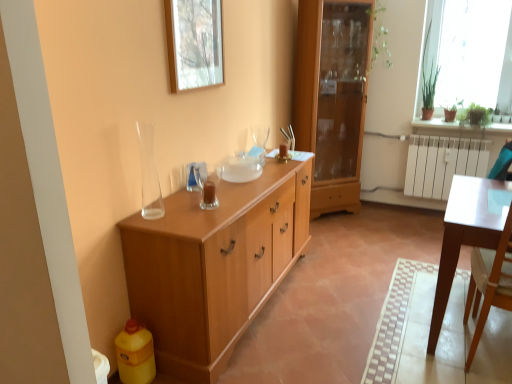
Where is `vacant area that lies between translucent glass candle at center and transparent glass vase at left`? The height and width of the screenshot is (384, 512). vacant area that lies between translucent glass candle at center and transparent glass vase at left is located at coordinates (182, 205).